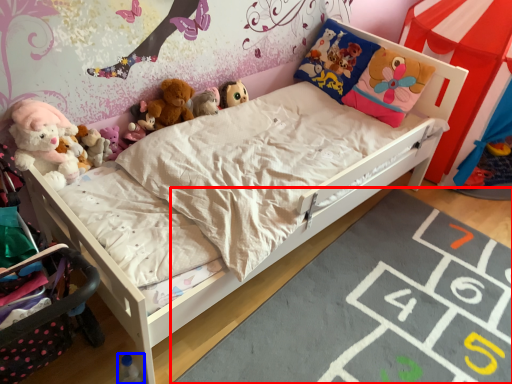
Question: Which point is further to the camera, mat (highlighted by a red box) or toy (highlighted by a blue box)?

Choices:
 (A) mat
 (B) toy

Answer: (B)